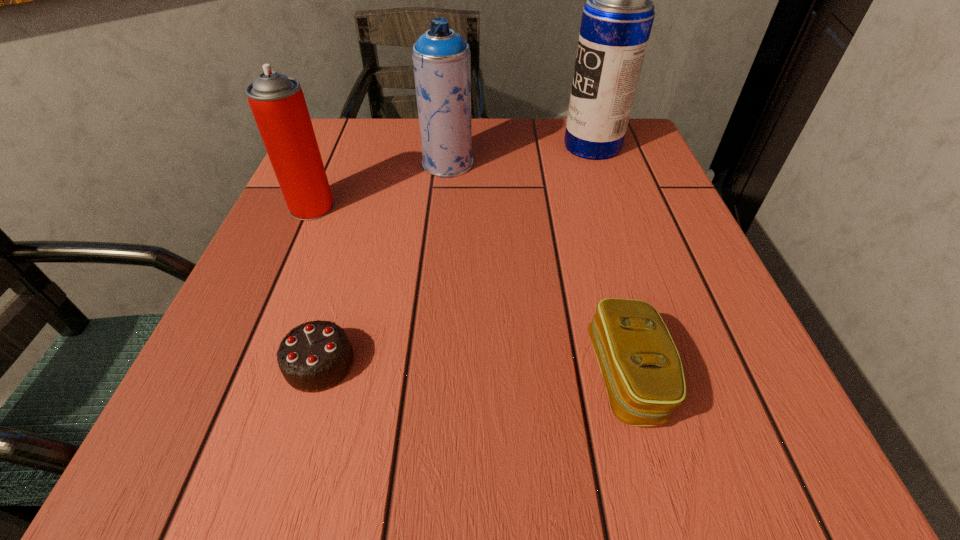
At what (x,y) coordinates should I click in order to perform the action: click on the tallest object. Please return your answer as a coordinate pair (x, y). Image resolution: width=960 pixels, height=540 pixels. Looking at the image, I should click on (617, 19).

This screenshot has height=540, width=960. Find the location of `the rightmost aerosol can`. the rightmost aerosol can is located at coordinates (617, 19).

Identify the location of the third object from left to right. This screenshot has height=540, width=960. (441, 57).

This screenshot has width=960, height=540. Find the location of `the leftmost object`. the leftmost object is located at coordinates (277, 102).

Where is `the leftmost aerosol can`? This screenshot has width=960, height=540. the leftmost aerosol can is located at coordinates (277, 102).

Locate an element on the screen. The image size is (960, 540). clutch bag is located at coordinates (640, 365).

Locate an element on the screen. chocolate cake is located at coordinates (315, 356).

Locate an element on the screen. The height and width of the screenshot is (540, 960). the fourth object from right to left is located at coordinates (315, 356).

The height and width of the screenshot is (540, 960). I want to click on free space located on the label side of the rightmost aerosol can, so click(529, 146).

Locate an element on the screen. free space located 0.060m on the label side of the rightmost aerosol can is located at coordinates (538, 146).